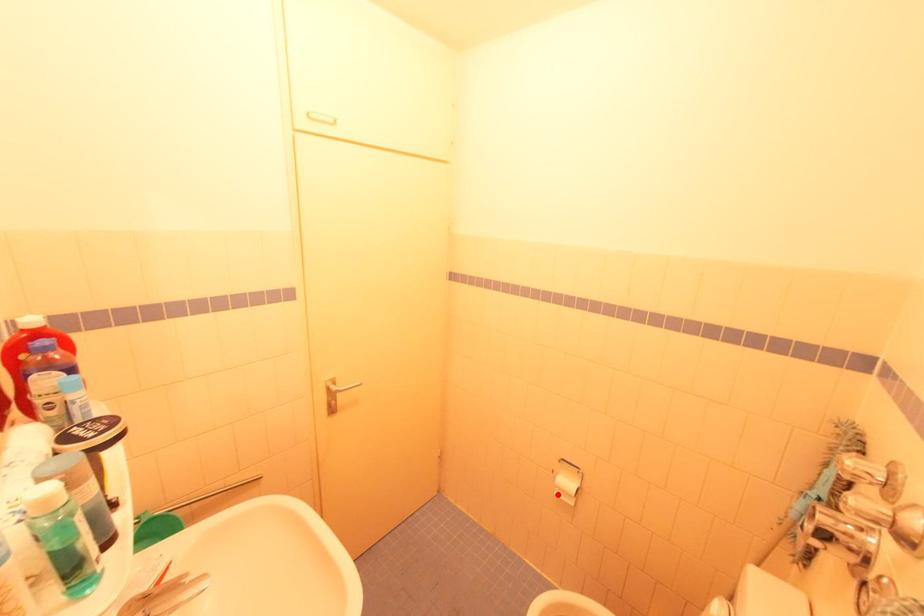
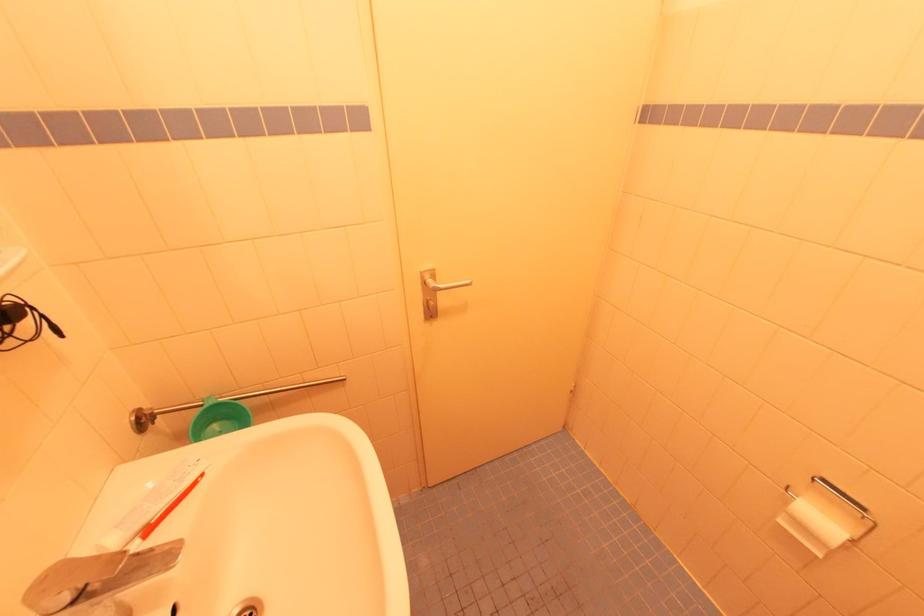
Where in the second image is the point corresponding to the highlighted location from the first image?

(784, 523)